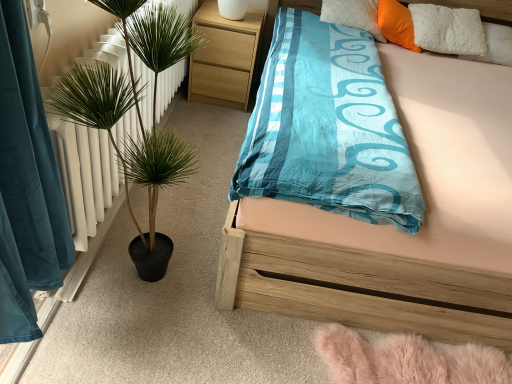
Question: Is light wood/texture nightstand at upper center bigger than green leafy plant in pot at left?

Choices:
 (A) no
 (B) yes

Answer: (A)

Question: Does light wood/texture nightstand at upper center come in front of green leafy plant in pot at left?

Choices:
 (A) yes
 (B) no

Answer: (B)

Question: Can you confirm if light wood/texture nightstand at upper center is positioned to the right of green leafy plant in pot at left?

Choices:
 (A) no
 (B) yes

Answer: (B)

Question: Is light wood/texture nightstand at upper center oriented away from green leafy plant in pot at left?

Choices:
 (A) yes
 (B) no

Answer: (B)

Question: From the image's perspective, is light wood/texture nightstand at upper center located beneath green leafy plant in pot at left?

Choices:
 (A) no
 (B) yes

Answer: (A)

Question: From the image's perspective, is wooden bed at center located above or below orange plush pillow at upper right?

Choices:
 (A) below
 (B) above

Answer: (A)

Question: Is point (x=313, y=311) positioned closer to the camera than point (x=382, y=11)?

Choices:
 (A) closer
 (B) farther

Answer: (A)

Question: Considering the relative positions of wooden bed at center and orange plush pillow at upper right in the image provided, is wooden bed at center to the left or to the right of orange plush pillow at upper right?

Choices:
 (A) left
 (B) right

Answer: (A)

Question: In terms of width, does wooden bed at center look wider or thinner when compared to orange plush pillow at upper right?

Choices:
 (A) thin
 (B) wide

Answer: (B)

Question: From their relative heights in the image, would you say wooden bed at center is taller or shorter than green leafy plant in pot at left?

Choices:
 (A) short
 (B) tall

Answer: (A)

Question: From a real-world perspective, is wooden bed at center above or below green leafy plant in pot at left?

Choices:
 (A) above
 (B) below

Answer: (B)

Question: Is wooden bed at center inside or outside of green leafy plant in pot at left?

Choices:
 (A) inside
 (B) outside

Answer: (B)

Question: Considering the positions of wooden bed at center and green leafy plant in pot at left in the image, is wooden bed at center bigger or smaller than green leafy plant in pot at left?

Choices:
 (A) small
 (B) big

Answer: (B)

Question: From a real-world perspective, is green leafy plant in pot at left physically located above or below wooden bed at center?

Choices:
 (A) above
 (B) below

Answer: (A)

Question: From the image's perspective, is green leafy plant in pot at left located above or below wooden bed at center?

Choices:
 (A) above
 (B) below

Answer: (B)